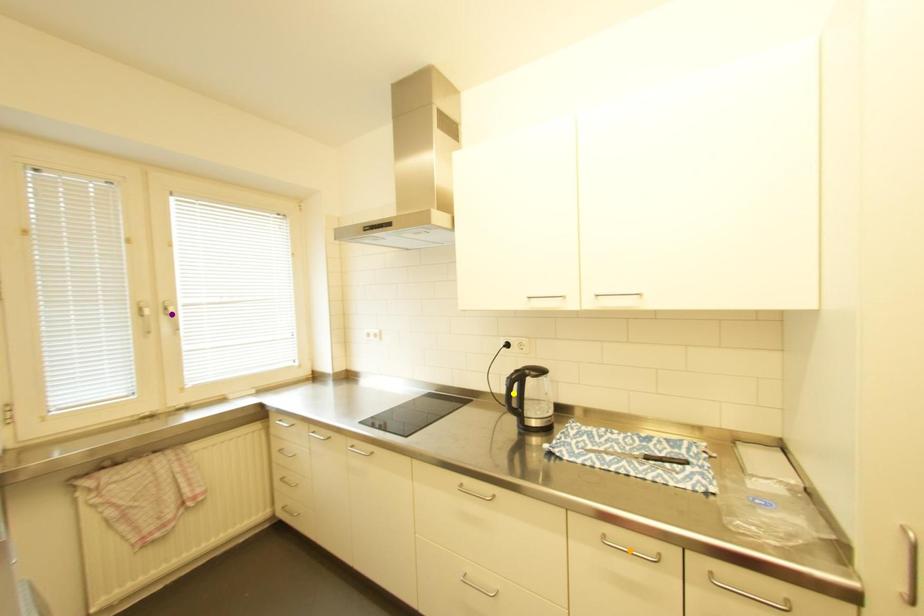
Order these from nearest to farthest:
yellow point
orange point
purple point

1. purple point
2. yellow point
3. orange point